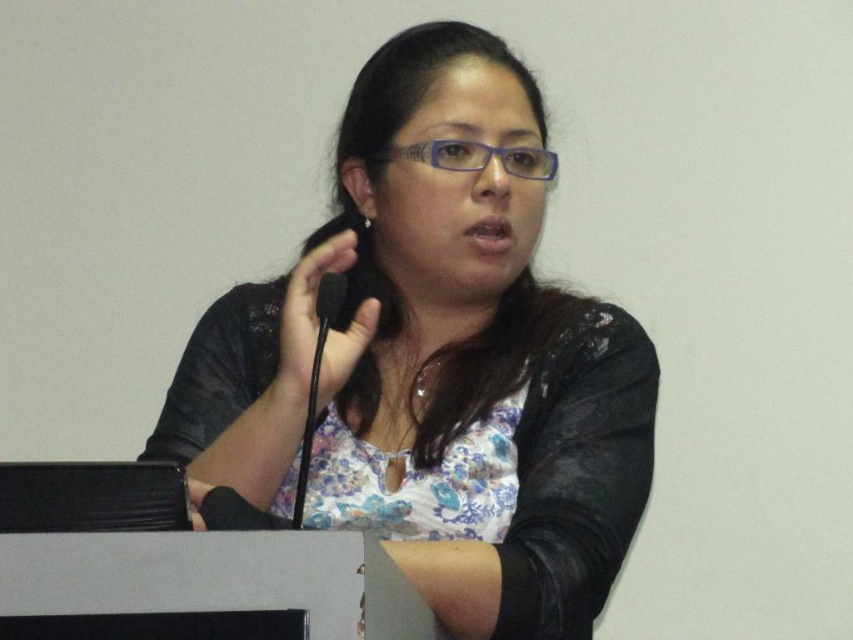
Locate an element on the screen. Image resolution: width=853 pixels, height=640 pixels. blue plastic glasses at center is located at coordinates (474, 157).

Can you confirm if blue plastic glasses at center is shorter than black matte microphone at center?

Yes, blue plastic glasses at center is shorter than black matte microphone at center.

Who is more distant from viewer, (529, 148) or (312, 369)?

The point (529, 148) is behind.

The width and height of the screenshot is (853, 640). Find the location of `blue plastic glasses at center`. blue plastic glasses at center is located at coordinates (x=474, y=157).

Is black matte microphone at center taller than black foam microphone at center?

Indeed, black matte microphone at center has a greater height compared to black foam microphone at center.

Does point (329, 296) come farther from viewer compared to point (323, 304)?

Yes, point (329, 296) is farther from viewer.

The image size is (853, 640). In order to click on black matte microphone at center in this screenshot , I will do `click(316, 378)`.

Is matte black jacket at center to the left of black matte microphone at center from the viewer's perspective?

No, matte black jacket at center is not to the left of black matte microphone at center.

At what (x,y) coordinates should I click in order to perform the action: click on matte black jacket at center. Please return your answer as a coordinate pair (x, y). This screenshot has width=853, height=640. Looking at the image, I should click on (433, 365).

Between point (381, 77) and point (329, 278), which one is positioned behind?

The point (381, 77) is more distant.

I want to click on matte black jacket at center, so click(x=433, y=365).